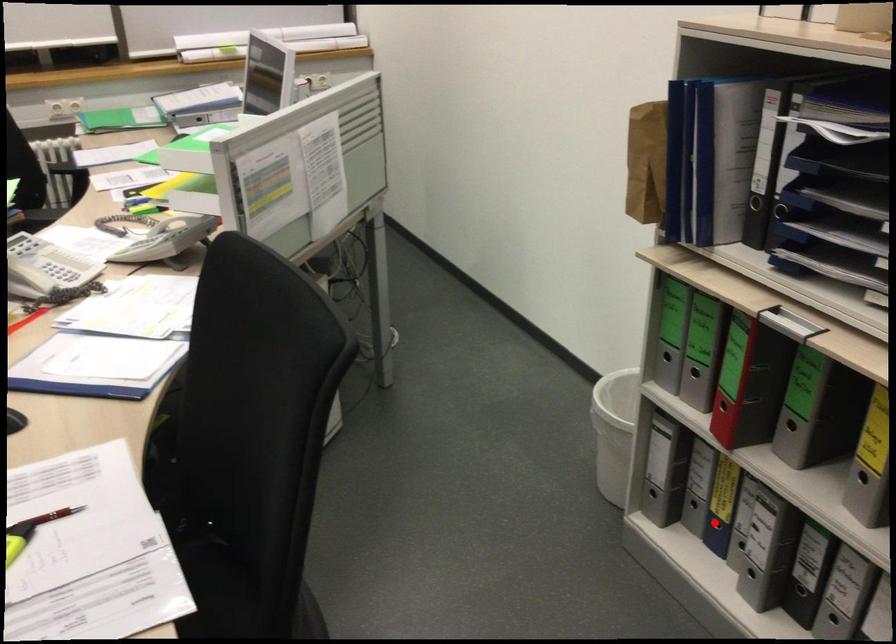
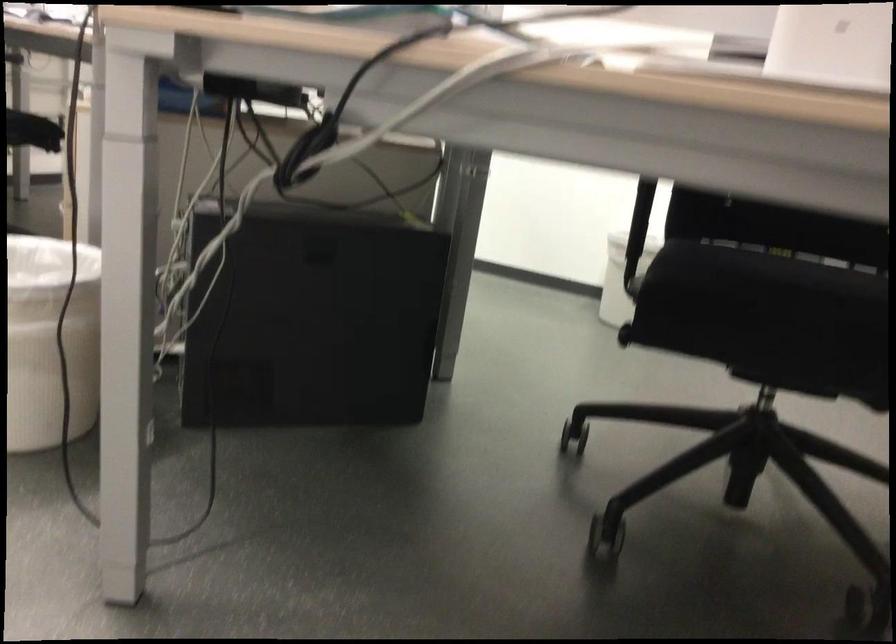
Question: I am providing you with two images of the same scene from different viewpoints. A red point is marked on the first image. At the location where the point appears in image 1, is it still visible in image 2?

Choices:
 (A) Yes
 (B) No

Answer: (B)